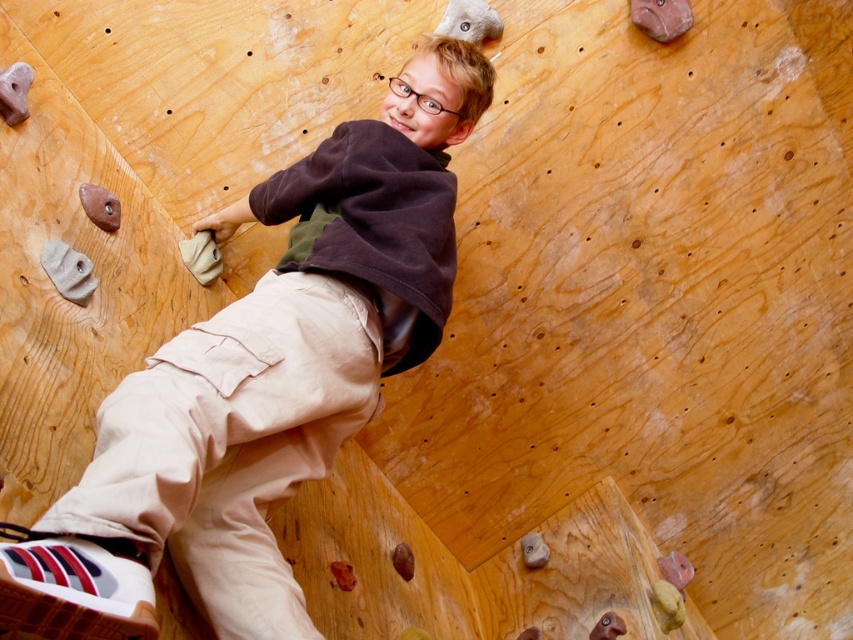
Can you confirm if brown cotton shirt at upper center is positioned to the left of khaki pants at center?

Incorrect, brown cotton shirt at upper center is not on the left side of khaki pants at center.

Is brown cotton shirt at upper center wider than khaki pants at center?

Yes.

Between point (451, 42) and point (233, 449), which one is positioned in front?

Point (233, 449) is more forward.

Identify the location of brown cotton shirt at upper center. The width and height of the screenshot is (853, 640). (271, 371).